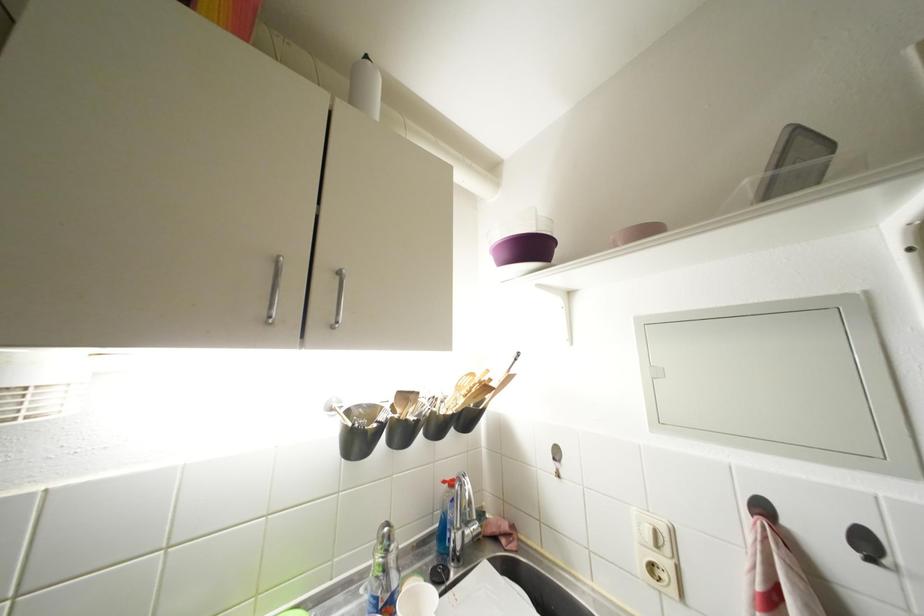
Find where to push the blue bottle cap. Please return your answer as a coordinate pair (x, y).

(366, 57)